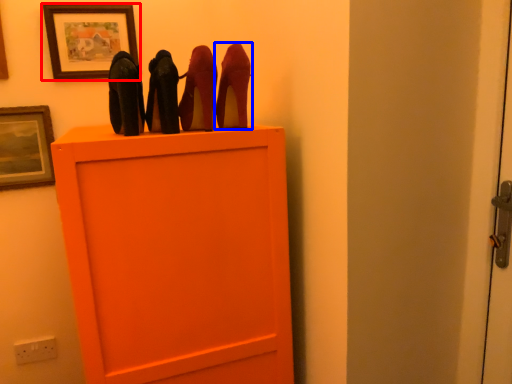
Question: Which object is closer to the camera taking this photo, picture frame (highlighted by a red box) or high heels (highlighted by a blue box)?

Choices:
 (A) picture frame
 (B) high heels

Answer: (B)